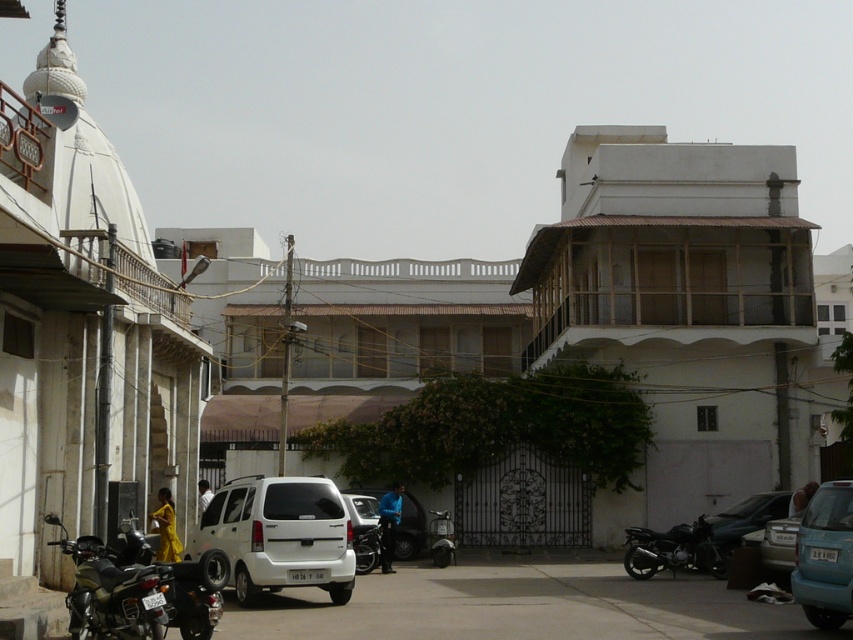
Is shiny black motorcycle at lower left wider than shiny black motorcycle at center?

Correct, the width of shiny black motorcycle at lower left exceeds that of shiny black motorcycle at center.

Between point (171, 620) and point (389, 561), which one is positioned behind?

The point (389, 561) is behind.

This screenshot has height=640, width=853. I want to click on shiny black motorcycle at lower left, so click(x=195, y=595).

Does shiny black motorcycle at lower left appear over shiny black motorcycle at lower right?

Yes, shiny black motorcycle at lower left is above shiny black motorcycle at lower right.

Is shiny black motorcycle at lower left bigger than shiny black motorcycle at lower right?

Indeed, shiny black motorcycle at lower left has a larger size compared to shiny black motorcycle at lower right.

Where is `shiny black motorcycle at lower left`? shiny black motorcycle at lower left is located at coordinates (195, 595).

Can you confirm if light blue matte car at center is positioned below matte black car at lower right?

No, light blue matte car at center is not below matte black car at lower right.

Which is in front, point (828, 486) or point (717, 524)?

Positioned in front is point (828, 486).

Which is in front, point (851, 525) or point (769, 504)?

Positioned in front is point (851, 525).

This screenshot has height=640, width=853. I want to click on light blue matte car at center, so click(x=825, y=556).